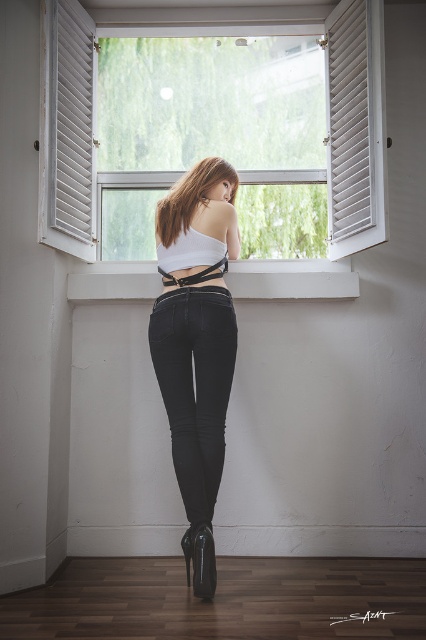
Between matte black jeans at center and white smooth window sill at center, which one has more height?

With more height is matte black jeans at center.

Which is below, matte black jeans at center or white smooth window sill at center?

Positioned lower is matte black jeans at center.

This screenshot has width=426, height=640. Find the location of `matte black jeans at center`. matte black jeans at center is located at coordinates (196, 344).

Does white wooden window at center come behind matte black jeans at center?

Yes.

Which is behind, point (81, 12) or point (218, 220)?

Positioned behind is point (81, 12).

Does point (340, 182) lie behind point (175, 440)?

Yes, point (340, 182) is behind point (175, 440).

At what (x,y) coordinates should I click in order to perform the action: click on white wooden window at center. Please return your answer as a coordinate pair (x, y). The image size is (426, 640). Looking at the image, I should click on (351, 129).

Is the position of white smooth window sill at center less distant than that of black patent leather boot at lower center?

No, white smooth window sill at center is further to the viewer.

This screenshot has height=640, width=426. In order to click on white smooth window sill at center in this screenshot , I will do click(x=293, y=284).

Measure the distance between white smooth window sill at center and camera.

A distance of 2.83 meters exists between white smooth window sill at center and camera.

Locate an element on the screen. The image size is (426, 640). white smooth window sill at center is located at coordinates pos(293,284).